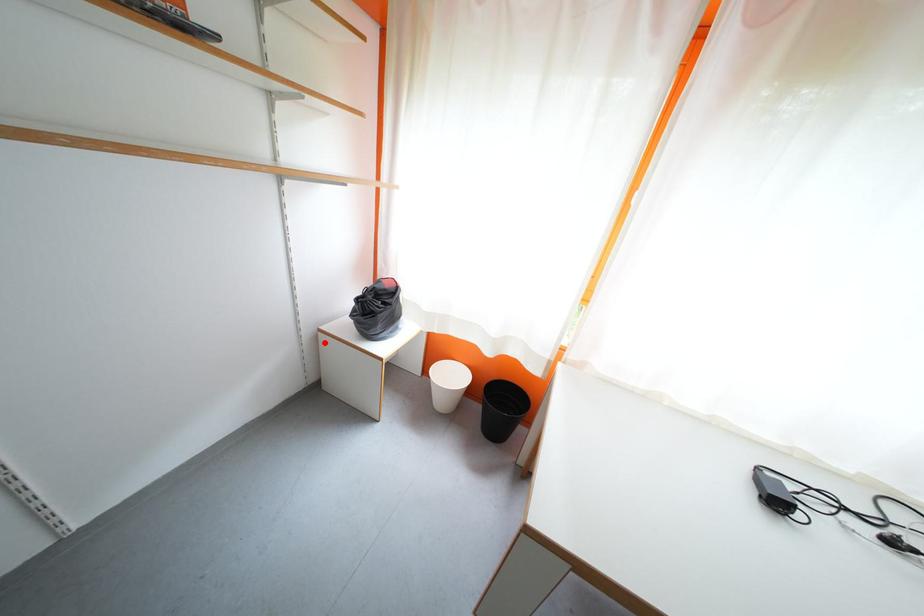
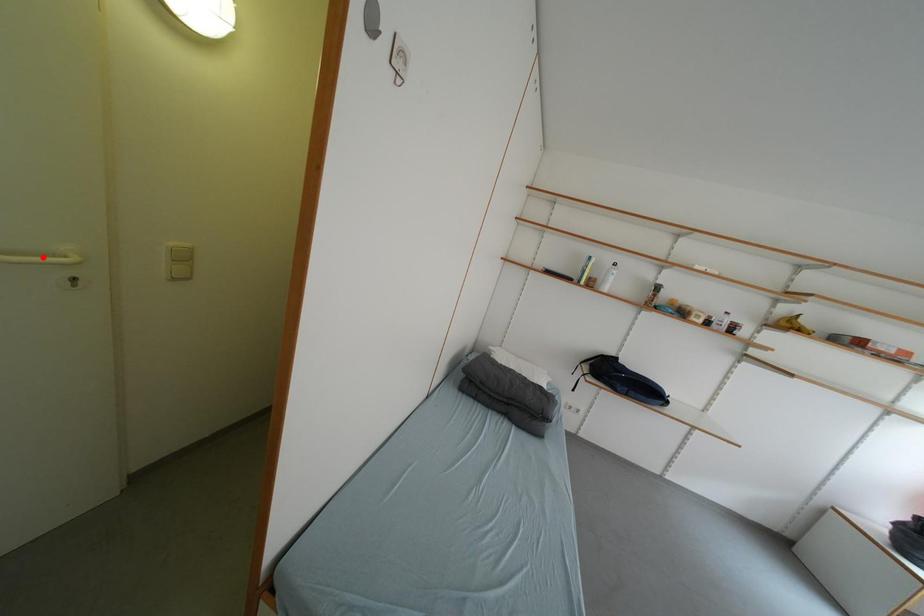
I am providing you with two images of the same scene from different viewpoints. A red point is marked on the first image and another point is marked on the second image. Is the red point in image1 aligned with the point shown in image2?

No